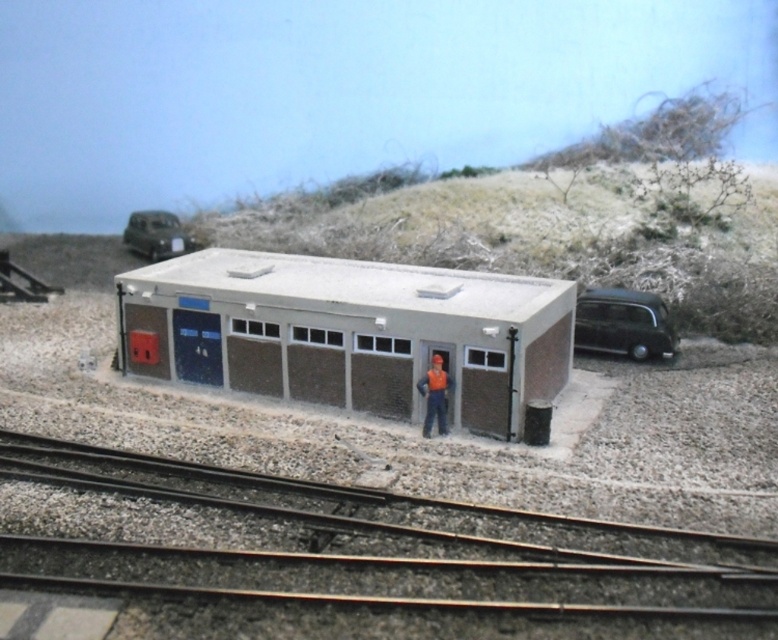
Can you confirm if smooth metal tracks at center is thinner than metallic green car at upper left?

No, smooth metal tracks at center is not thinner than metallic green car at upper left.

Identify the location of smooth metal tracks at center. pyautogui.click(x=373, y=547).

Is point (649, 304) positioned before point (151, 244)?

Yes, point (649, 304) is in front of point (151, 244).

Which is behind, point (587, 340) or point (128, 221)?

Positioned behind is point (128, 221).

Does point (601, 336) lie in front of point (167, 212)?

Yes, point (601, 336) is closer to viewer.

This screenshot has height=640, width=778. Find the location of `shiny black car at right`. shiny black car at right is located at coordinates (622, 323).

Does matte gray shed at center have a lesser height compared to orange fabric worker at center?

Incorrect, matte gray shed at center's height does not fall short of orange fabric worker at center's.

Which is above, matte gray shed at center or orange fabric worker at center?

matte gray shed at center is above.

Which is in front, point (402, 368) or point (433, 419)?

Point (433, 419) is more forward.

What are the coordinates of `matte gray shed at center` in the screenshot? It's located at click(349, 332).